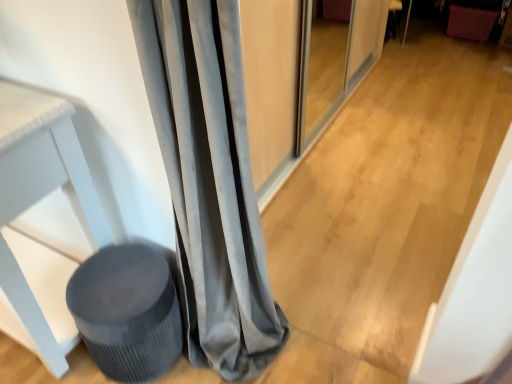
This screenshot has height=384, width=512. In order to click on spots to the right of matte gray screen door at center in this screenshot , I will do `click(423, 110)`.